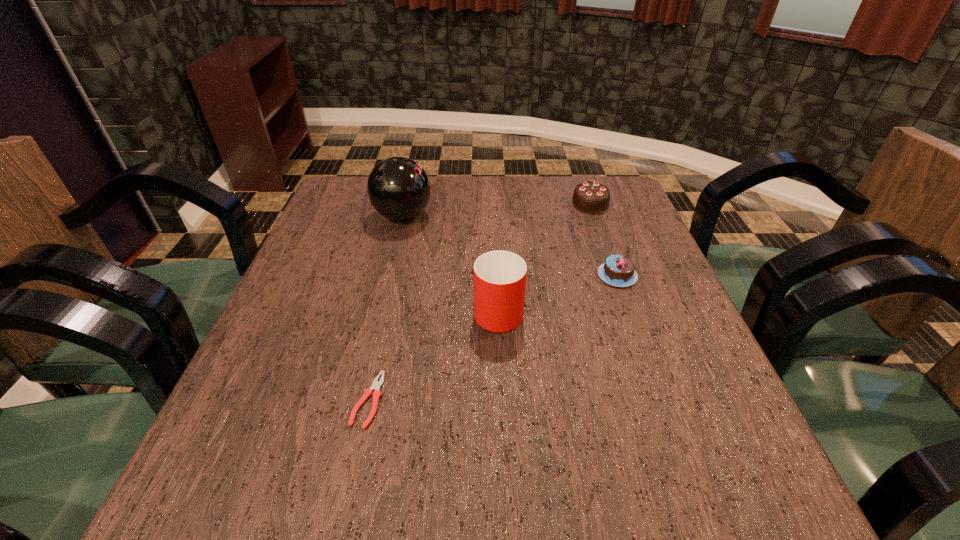
Find the location of a particular element. vacant region located on the side of the cup with the handle is located at coordinates (494, 216).

Where is `free location located 0.230m on the side of the cup with the handle`? The height and width of the screenshot is (540, 960). free location located 0.230m on the side of the cup with the handle is located at coordinates (494, 227).

The height and width of the screenshot is (540, 960). In order to click on vacant space located on the side of the cup with the handle in this screenshot , I will do `click(494, 216)`.

You are a GUI agent. You are given a task and a screenshot of the screen. Output one action in this format:
    pyautogui.click(x=<x>, y=<y>)
    Task: Click on the blank space located on the left of the farther chocolate cake
    
    Given the screenshot: What is the action you would take?
    pyautogui.click(x=437, y=204)

The height and width of the screenshot is (540, 960). What are the coordinates of `free space located on the back of the nearer chocolate cake` in the screenshot? It's located at (604, 238).

Where is `vacant region located 0.250m on the back of the nearest object`? vacant region located 0.250m on the back of the nearest object is located at coordinates (395, 282).

Where is `bowling ball present at the far edge`? The height and width of the screenshot is (540, 960). bowling ball present at the far edge is located at coordinates (398, 188).

Image resolution: width=960 pixels, height=540 pixels. Find the location of `chocolate cake situated at the far edge`. chocolate cake situated at the far edge is located at coordinates (592, 197).

Where is `object that is at the left edge`? The height and width of the screenshot is (540, 960). object that is at the left edge is located at coordinates (398, 188).

The image size is (960, 540). Find the location of `object situated at the far left corner`. object situated at the far left corner is located at coordinates (398, 188).